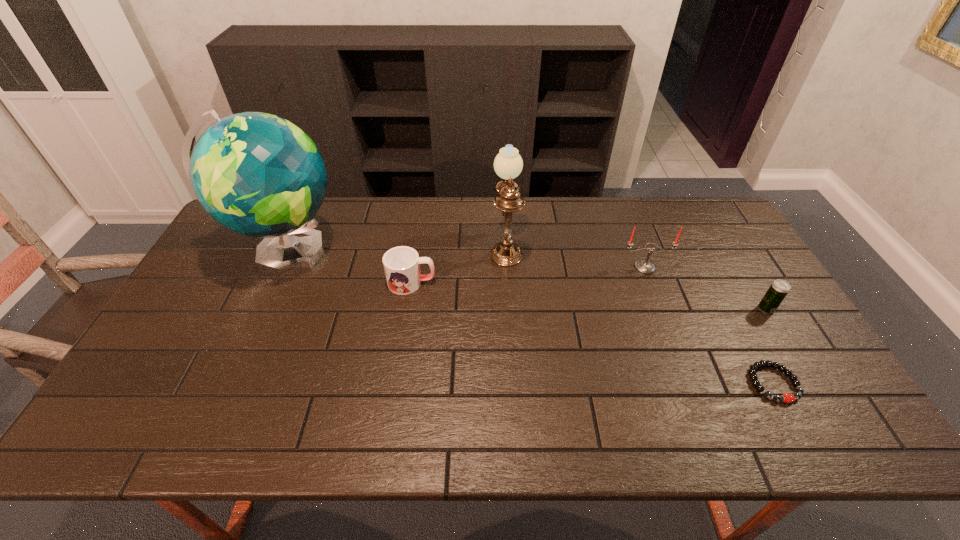
Identify the location of blank area in the image that satisfies the following two spatial constraints: 1. on the front surface of the fifth farthest object; 2. on the right side of the globe. (261, 309).

Find the location of `vacant area in the image that satisfies the following two spatial constraints: 1. on the back side of the nearest object; 2. on the right side of the beer can`. vacant area in the image that satisfies the following two spatial constraints: 1. on the back side of the nearest object; 2. on the right side of the beer can is located at coordinates (733, 309).

You are a GUI agent. You are given a task and a screenshot of the screen. Output one action in this format:
    pyautogui.click(x=<x>, y=<y>)
    Task: Click on the vacant area in the image that satisfies the following two spatial constraints: 1. on the front surface of the fifth farthest object; 2. on the right side of the leftmost object
    
    Given the screenshot: What is the action you would take?
    pyautogui.click(x=261, y=309)

Identify the location of vacant position in the image that satisfies the following two spatial constraints: 1. on the side of the second object from right to left with the handle; 2. on the right side of the mug. (396, 383).

At what (x,y) coordinates should I click in order to perform the action: click on vacant space that satisfies the following two spatial constraints: 1. on the front side of the second tallest object; 2. on the right side of the beer can. Please return your answer as a coordinate pair (x, y). Looking at the image, I should click on (510, 309).

The image size is (960, 540). Find the location of `free location that satisfies the following two spatial constraints: 1. on the front-facing side of the candle; 2. on the side of the mug with the handle`. free location that satisfies the following two spatial constraints: 1. on the front-facing side of the candle; 2. on the side of the mug with the handle is located at coordinates 651,282.